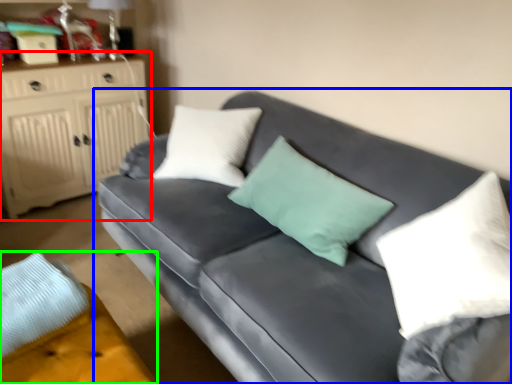
Question: Which object is positioned closest to cabinetry (highlighted by a red box)? Select from studio couch (highlighted by a blue box) and footrest (highlighted by a green box).

Choices:
 (A) studio couch
 (B) footrest

Answer: (A)